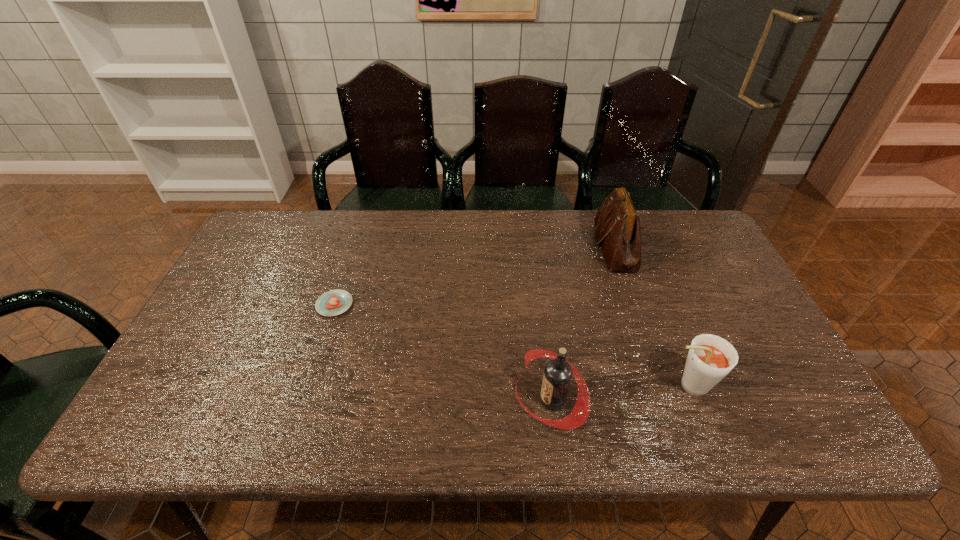
Locate an element on the screen. Image resolution: width=960 pixels, height=540 pixels. vacant area between the shoulder bag and the third object from right to left is located at coordinates (583, 323).

Point out which object is positioned as the nearest to the right root beer. Please provide its 2D coordinates. Your answer should be formatted as a tuple, i.e. [(x, y)], where the tuple contains the x and y coordinates of a point satisfying the conditions above.

[(557, 376)]

In order to click on object that stands as the third closest to the leftmost object in this screenshot , I will do `click(710, 358)`.

At what (x,y) coordinates should I click in order to perform the action: click on free location that satisfies the following two spatial constraints: 1. on the front side of the shoulder bag; 2. on the label of the left root beer. Please return your answer as a coordinate pair (x, y). This screenshot has height=540, width=960. Looking at the image, I should click on (666, 400).